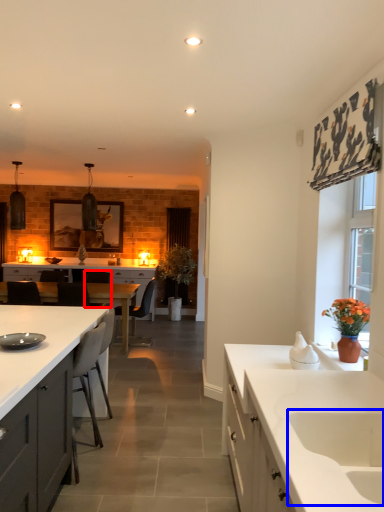
Question: Which of the following is the farthest to the observer, chair (highlighted by a red box) or sink (highlighted by a blue box)?

Choices:
 (A) chair
 (B) sink

Answer: (A)